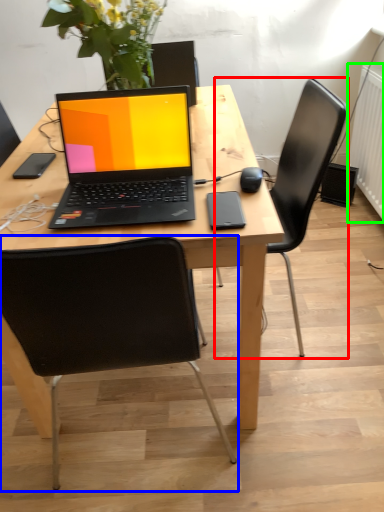
Question: Which object is positioned closest to chair (highlighted by a red box)? Select from chair (highlighted by a blue box) and radiator (highlighted by a green box).

Choices:
 (A) chair
 (B) radiator

Answer: (A)